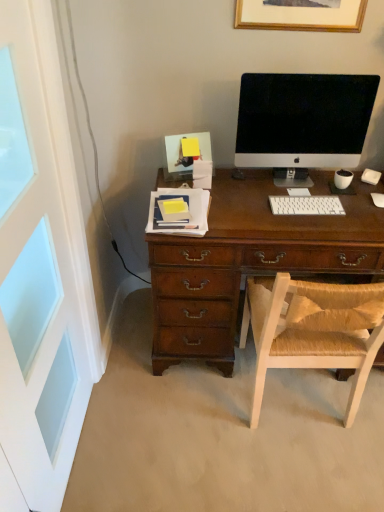
Question: In the image, is white plastic keyboard at center on the left side or the right side of white painted wood screen door at left?

Choices:
 (A) left
 (B) right

Answer: (B)

Question: Considering the positions of white plastic keyboard at center and white painted wood screen door at left in the image, is white plastic keyboard at center wider or thinner than white painted wood screen door at left?

Choices:
 (A) thin
 (B) wide

Answer: (B)

Question: Considering the real-world distances, which object is closest to the wooden picture frame at upper center?

Choices:
 (A) white plastic keyboard at center
 (B) light brown woven chair at center
 (C) white painted wood screen door at left
 (D) satin black monitor at center

Answer: (D)

Question: Which is farther from the wooden picture frame at upper center?

Choices:
 (A) light brown woven chair at center
 (B) white plastic keyboard at center
 (C) white painted wood screen door at left
 (D) satin black monitor at center

Answer: (C)